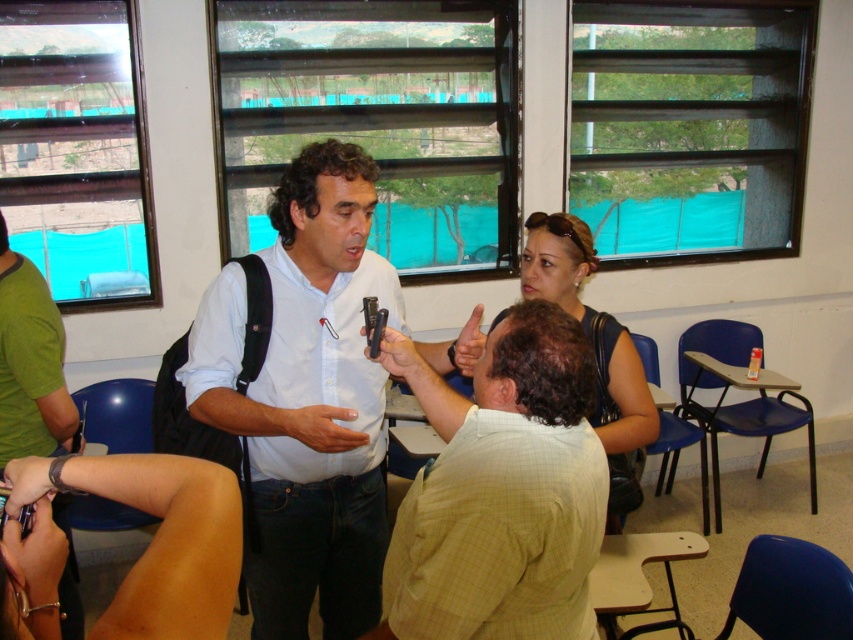
How much distance is there between smooth tan skin at lower left and smooth skin hand at center?

smooth tan skin at lower left is 28.17 inches from smooth skin hand at center.

The image size is (853, 640). Describe the element at coordinates (169, 545) in the screenshot. I see `smooth tan skin at lower left` at that location.

Identify the location of smooth tan skin at lower left. (169, 545).

Can you confirm if matte black wristwatch at lower left is taller than matte black hand at center?

In fact, matte black wristwatch at lower left may be shorter than matte black hand at center.

Who is more forward, (15, 481) or (465, 326)?

Point (15, 481) is more forward.

The height and width of the screenshot is (640, 853). What are the coordinates of `matte black wristwatch at lower left` in the screenshot? It's located at (28, 483).

In the scene shown: Is the position of smooth tan skin at lower left more distant than that of matte black wristwatch at lower left?

No.

Can you confirm if smooth tan skin at lower left is wider than matte black wristwatch at lower left?

Yes.

Is point (196, 563) farther from camera compared to point (7, 476)?

That is False.

The height and width of the screenshot is (640, 853). I want to click on smooth tan skin at lower left, so click(x=169, y=545).